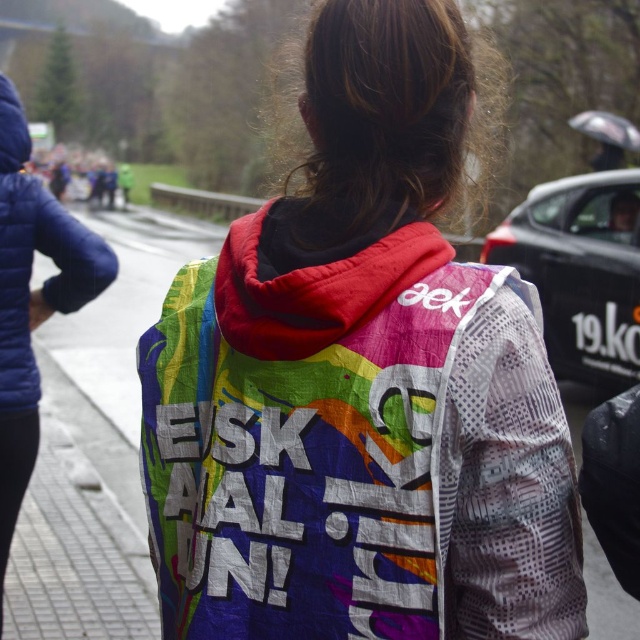
Question: Is rainbow fabric hoodie at center above rainbow fabric jacket at left?

Choices:
 (A) no
 (B) yes

Answer: (A)

Question: Based on their relative distances, which object is farther from the black textured car at right?

Choices:
 (A) rainbow fabric hoodie at center
 (B) rainbow fabric jacket at left

Answer: (A)

Question: Which of the following is the farthest from the observer?

Choices:
 (A) rainbow fabric hoodie at center
 (B) black textured car at right
 (C) rainbow fabric jacket at left

Answer: (B)

Question: Is black textured car at right positioned in front of rainbow fabric jacket at left?

Choices:
 (A) yes
 (B) no

Answer: (B)

Question: Which is nearer to the rainbow fabric hoodie at center?

Choices:
 (A) black textured car at right
 (B) rainbow fabric jacket at left

Answer: (B)

Question: Does rainbow fabric hoodie at center have a larger size compared to rainbow fabric jacket at left?

Choices:
 (A) yes
 (B) no

Answer: (A)